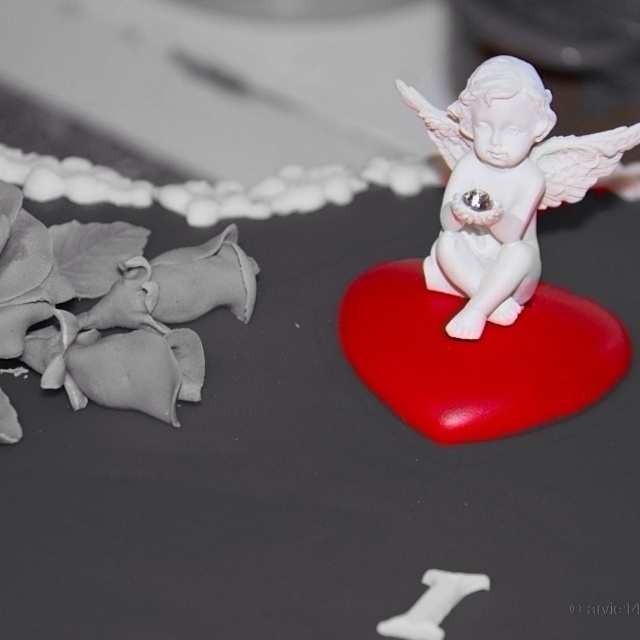
Who is lower down, matte gray petals at left or white glossy cherub at center right?

matte gray petals at left

Is matte gray petals at left further to the viewer compared to white glossy cherub at center right?

No.

Between point (42, 244) and point (492, 224), which one is positioned behind?

Point (492, 224)

At what (x,y) coordinates should I click in order to perform the action: click on matte gray petals at left. Please return your answer as a coordinate pair (x, y). This screenshot has width=640, height=640. Looking at the image, I should click on (113, 307).